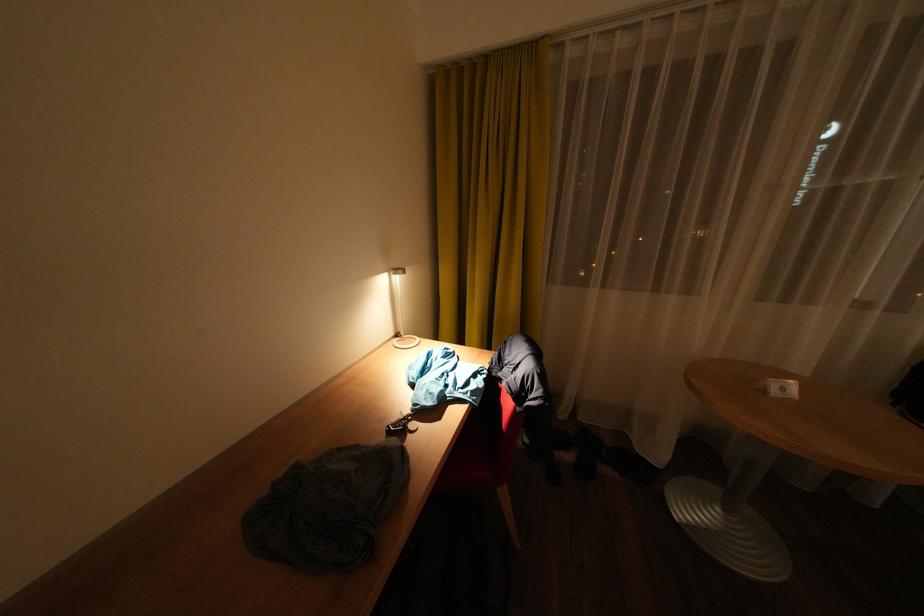
Where would you pull the yellow curtain? Please return your answer as a coordinate pair (x, y).

(492, 192)